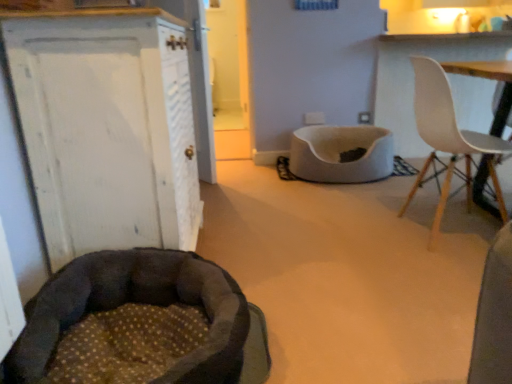
Question: Is point (28, 311) positioned closer to the camera than point (145, 168)?

Choices:
 (A) closer
 (B) farther

Answer: (A)

Question: Is dark brown plush dog bed at lower left taller or shorter than white painted wood cabinet at left?

Choices:
 (A) short
 (B) tall

Answer: (A)

Question: Which object is positioned farthest from the white plastic chair at upper right?

Choices:
 (A) white soft pet bed at center
 (B) dark brown plush dog bed at lower left
 (C) white painted wood cabinet at left

Answer: (C)

Question: Which of these objects is positioned farthest from the white soft pet bed at center?

Choices:
 (A) white plastic chair at upper right
 (B) white painted wood cabinet at left
 (C) dark brown plush dog bed at lower left

Answer: (C)